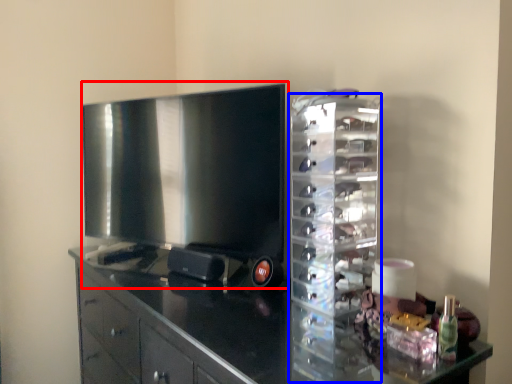
Question: Which of the following is the closest to the observer, home appliance (highlighted by a red box) or glass box (highlighted by a blue box)?

Choices:
 (A) home appliance
 (B) glass box

Answer: (B)